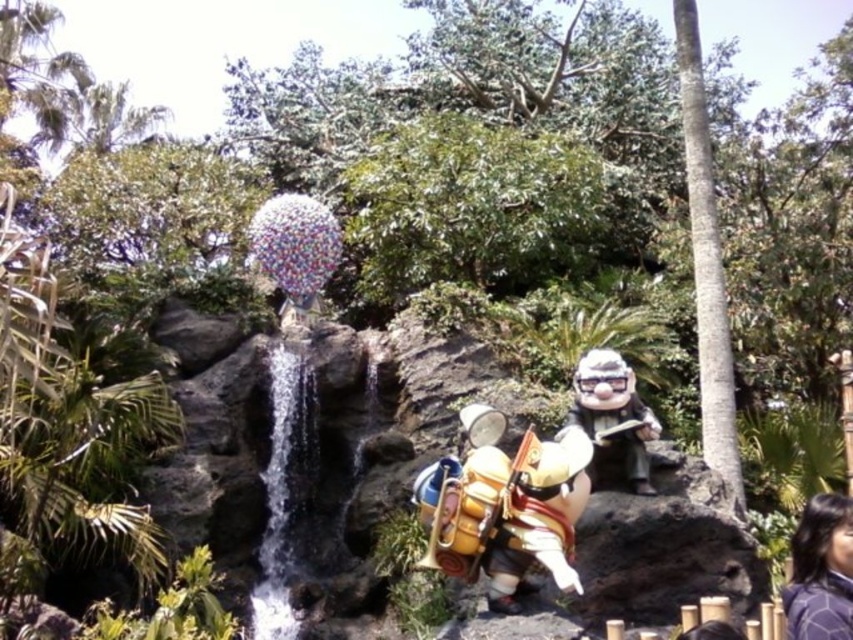
Who is higher up, clear water at center or matte brown statue at center?

matte brown statue at center is higher up.

Is clear water at center further to the viewer compared to matte brown statue at center?

No, it is not.

Between point (277, 582) and point (592, 358), which one is positioned in front?

Point (592, 358)

Identify the location of clear water at center. (280, 493).

Can you confirm if clear water at center is thinner than gold metallic armor at center?

No.

Which is in front, point (285, 461) or point (589, 486)?

Point (589, 486) is in front.

The image size is (853, 640). I want to click on clear water at center, so click(x=280, y=493).

Can you confirm if dark blue textured shirt at lower right is positioned below matte brown statue at center?

Yes.

Find the location of a particular element. dark blue textured shirt at lower right is located at coordinates (821, 572).